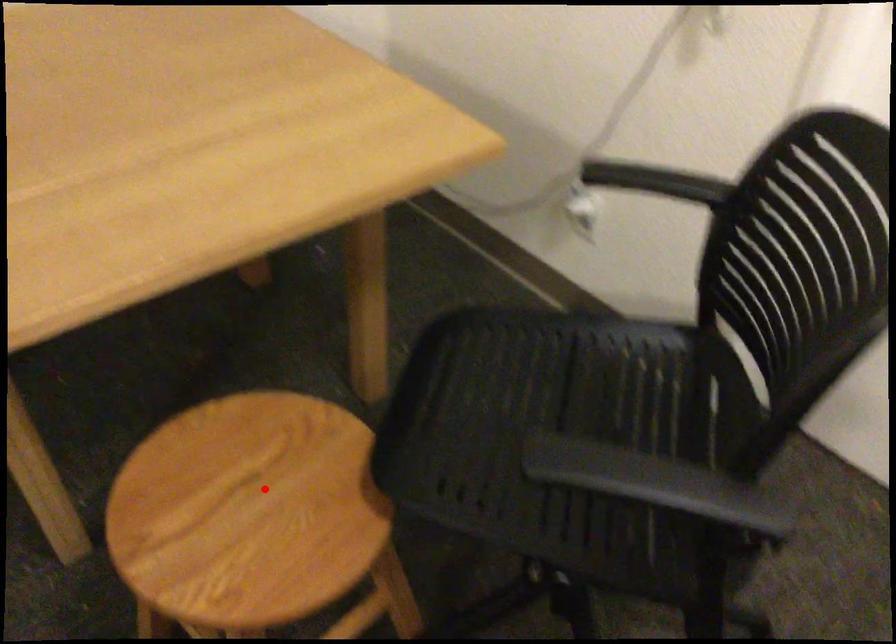
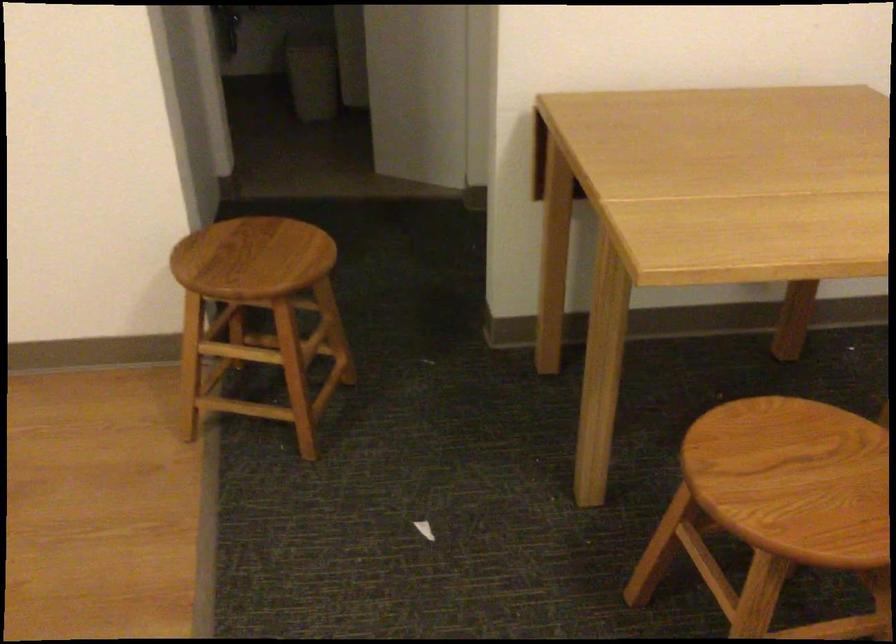
In the second image, find the point that corresponds to the highlighted location in the first image.

(807, 476)